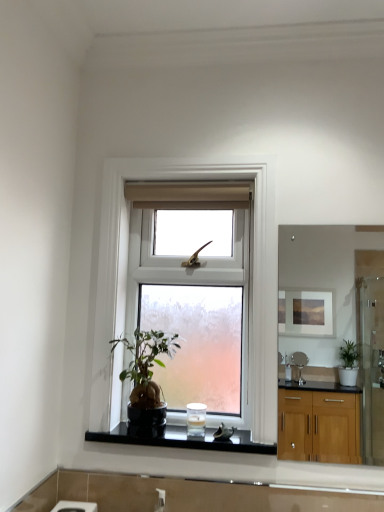
Question: Is matte wooden mirror at upper right further to the viewer compared to green matte houseplant at center?

Choices:
 (A) yes
 (B) no

Answer: (A)

Question: Is matte wooden mirror at upper right facing away from green matte houseplant at center?

Choices:
 (A) yes
 (B) no

Answer: (B)

Question: Does matte wooden mirror at upper right have a lesser height compared to green matte houseplant at center?

Choices:
 (A) yes
 (B) no

Answer: (B)

Question: Could you tell me if matte wooden mirror at upper right is facing green matte houseplant at center?

Choices:
 (A) no
 (B) yes

Answer: (A)

Question: Does matte wooden mirror at upper right appear on the right side of green matte houseplant at center?

Choices:
 (A) no
 (B) yes

Answer: (B)

Question: In the image, is clear glass window at center positioned in front of or behind white frosted glass candle at center?

Choices:
 (A) front
 (B) behind

Answer: (A)

Question: Is clear glass window at center taller or shorter than white frosted glass candle at center?

Choices:
 (A) short
 (B) tall

Answer: (B)

Question: Is clear glass window at center bigger or smaller than white frosted glass candle at center?

Choices:
 (A) big
 (B) small

Answer: (A)

Question: Is clear glass window at center spatially inside white frosted glass candle at center, or outside of it?

Choices:
 (A) inside
 (B) outside

Answer: (B)

Question: In the image, is black glossy stone at center positioned in front of or behind green matte houseplant at center?

Choices:
 (A) behind
 (B) front

Answer: (A)

Question: Is black glossy stone at center bigger or smaller than green matte houseplant at center?

Choices:
 (A) big
 (B) small

Answer: (B)

Question: Is black glossy stone at center to the left or to the right of green matte houseplant at center in the image?

Choices:
 (A) left
 (B) right

Answer: (B)

Question: Looking at their shapes, would you say black glossy stone at center is wider or thinner than green matte houseplant at center?

Choices:
 (A) thin
 (B) wide

Answer: (B)

Question: Would you say black glossy stone at center is inside or outside matte wooden mirror at upper right?

Choices:
 (A) inside
 (B) outside

Answer: (B)

Question: In terms of size, does black glossy stone at center appear bigger or smaller than matte wooden mirror at upper right?

Choices:
 (A) small
 (B) big

Answer: (A)